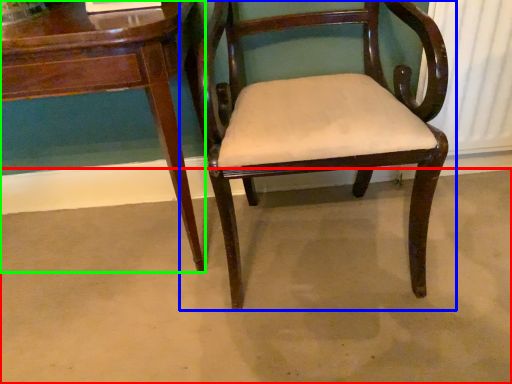
Question: Which is farther away from concrete (highlighted by a red box)? chair (highlighted by a blue box) or table (highlighted by a green box)?

Choices:
 (A) chair
 (B) table

Answer: (B)